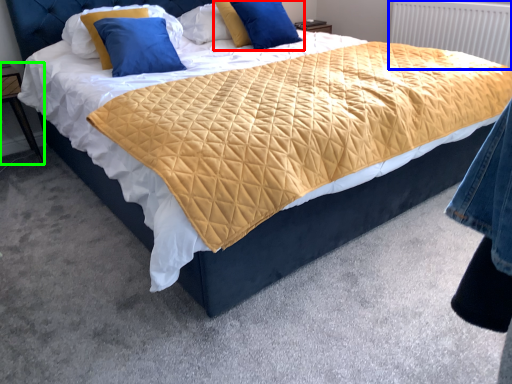
Question: Considering the real-world distances, which object is farthest from pillow (highlighted by a red box)? radiator (highlighted by a blue box) or nightstand (highlighted by a green box)?

Choices:
 (A) radiator
 (B) nightstand

Answer: (B)